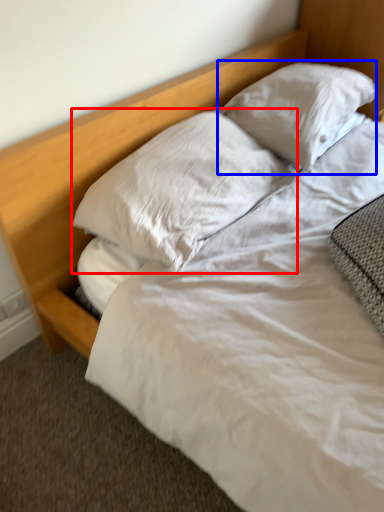
Question: Which point is further to the camera, pillow (highlighted by a red box) or pillow (highlighted by a blue box)?

Choices:
 (A) pillow
 (B) pillow

Answer: (B)